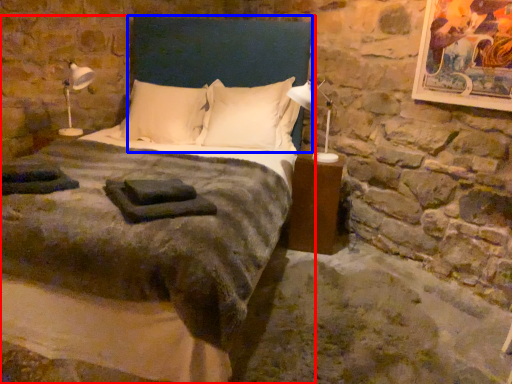
Question: Which object is closer to the camera taking this photo, bed (highlighted by a red box) or headboard (highlighted by a blue box)?

Choices:
 (A) bed
 (B) headboard

Answer: (A)